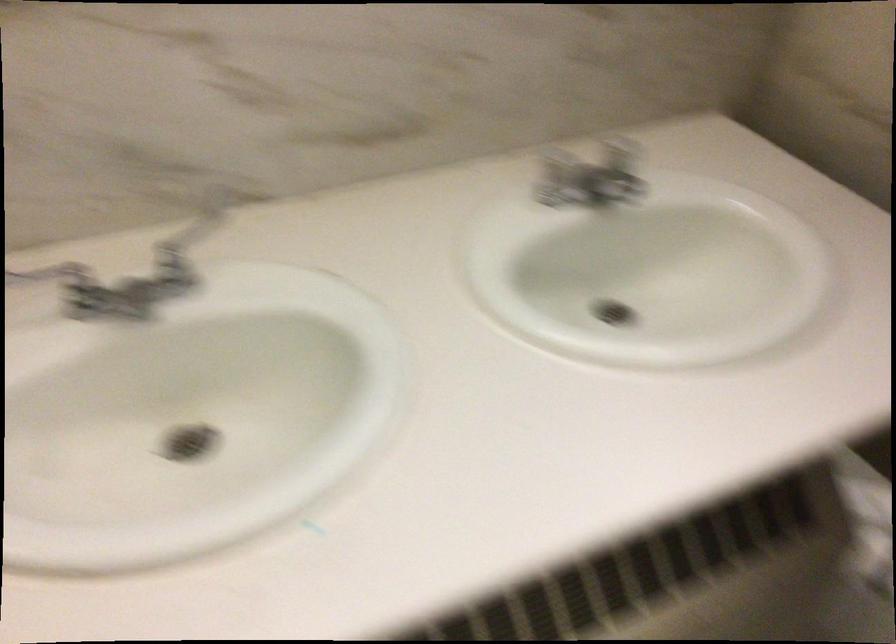
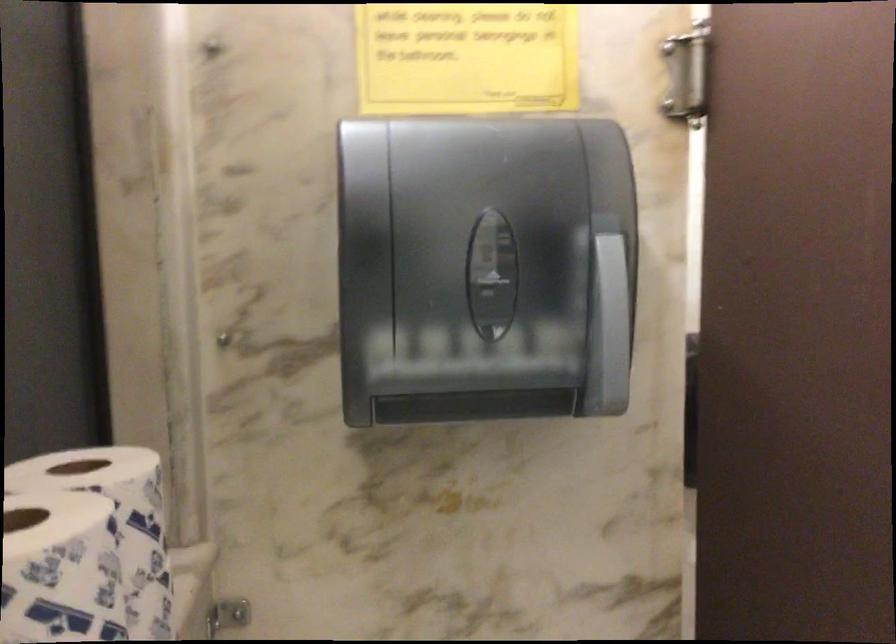
Question: Based on the continuous images, in which direction is the camera rotating? Reply with the corresponding letter.

Choices:
 (A) Left
 (B) Right
 (C) Up
 (D) Down

Answer: (B)